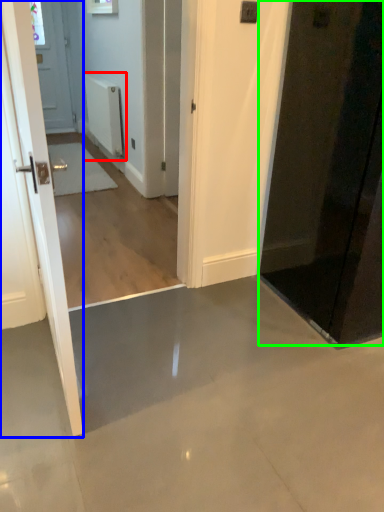
Question: Considering the real-world distances, which object is closest to radiator (highlighted by a red box)? door (highlighted by a blue box) or door (highlighted by a green box).

Choices:
 (A) door
 (B) door

Answer: (B)